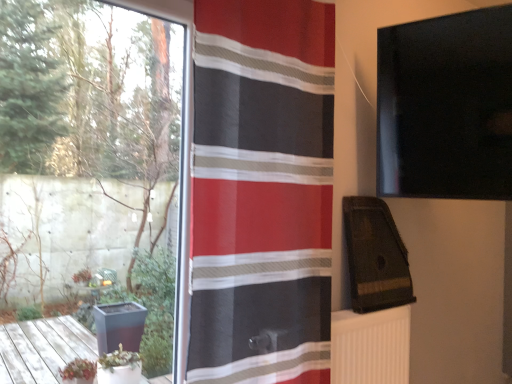
Question: Considering the relative sizes of red striped fabric at center and white ribbed radiator at lower right in the image provided, is red striped fabric at center taller than white ribbed radiator at lower right?

Choices:
 (A) yes
 (B) no

Answer: (A)

Question: Does red striped fabric at center have a lesser height compared to white ribbed radiator at lower right?

Choices:
 (A) no
 (B) yes

Answer: (A)

Question: Is the surface of red striped fabric at center in direct contact with white ribbed radiator at lower right?

Choices:
 (A) no
 (B) yes

Answer: (A)

Question: Is red striped fabric at center further to the viewer compared to white ribbed radiator at lower right?

Choices:
 (A) yes
 (B) no

Answer: (B)

Question: From a real-world perspective, is red striped fabric at center below white ribbed radiator at lower right?

Choices:
 (A) no
 (B) yes

Answer: (A)

Question: Based on their sizes in the image, would you say transparent glass window at left is bigger or smaller than red striped fabric at center?

Choices:
 (A) big
 (B) small

Answer: (A)

Question: Would you say transparent glass window at left is to the left or to the right of red striped fabric at center in the picture?

Choices:
 (A) right
 (B) left

Answer: (B)

Question: From the image's perspective, is transparent glass window at left above or below red striped fabric at center?

Choices:
 (A) above
 (B) below

Answer: (B)

Question: Would you say transparent glass window at left is inside or outside red striped fabric at center?

Choices:
 (A) outside
 (B) inside

Answer: (A)

Question: In the image, is transparent glass window at left positioned in front of or behind white ribbed radiator at lower right?

Choices:
 (A) behind
 (B) front

Answer: (B)

Question: Is transparent glass window at left taller or shorter than white ribbed radiator at lower right?

Choices:
 (A) tall
 (B) short

Answer: (A)

Question: From the image's perspective, is transparent glass window at left positioned above or below white ribbed radiator at lower right?

Choices:
 (A) below
 (B) above

Answer: (B)

Question: Looking at their shapes, would you say transparent glass window at left is wider or thinner than white ribbed radiator at lower right?

Choices:
 (A) wide
 (B) thin

Answer: (A)

Question: From their relative heights in the image, would you say white ribbed radiator at lower right is taller or shorter than red striped fabric at center?

Choices:
 (A) short
 (B) tall

Answer: (A)

Question: From a real-world perspective, is white ribbed radiator at lower right positioned above or below red striped fabric at center?

Choices:
 (A) above
 (B) below

Answer: (B)